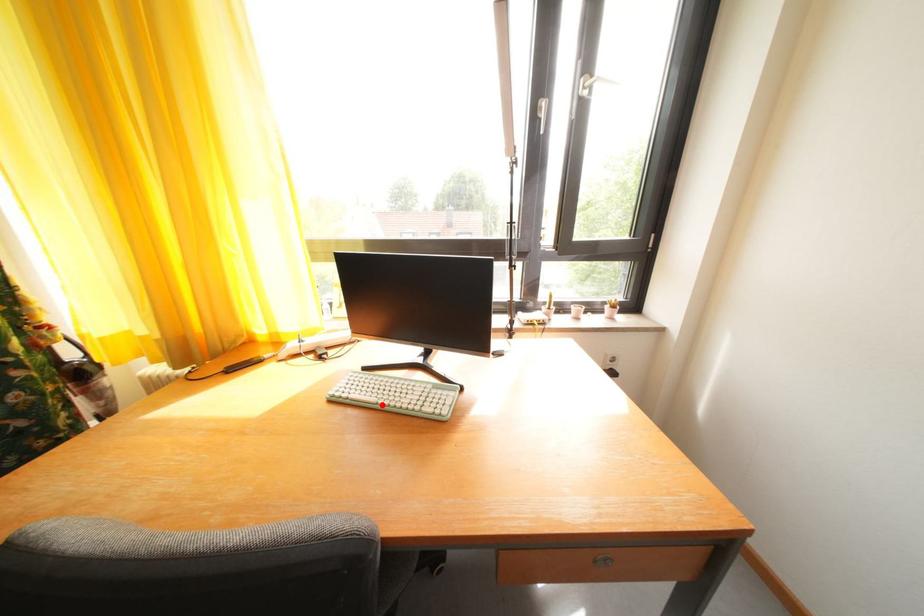
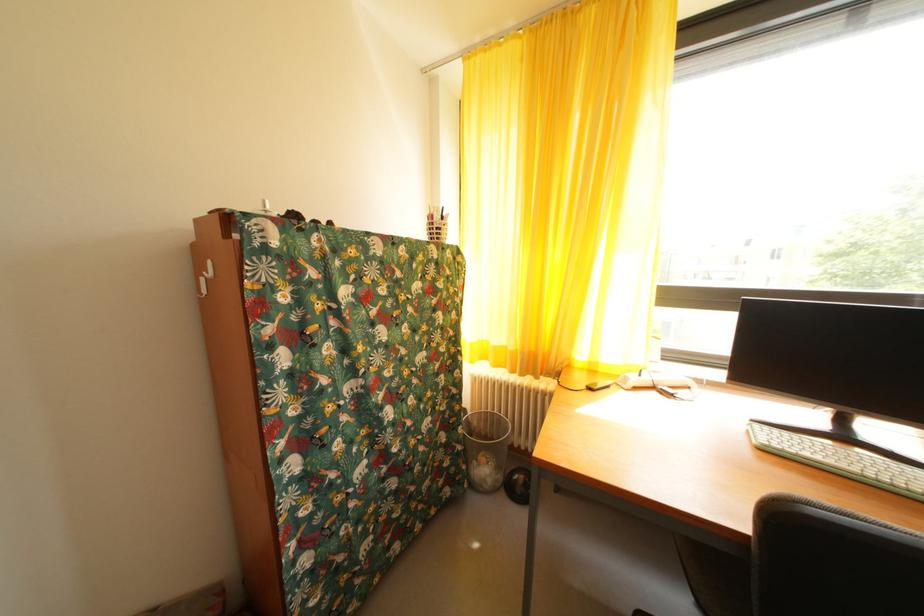
Question: I am providing you with two images of the same scene from different viewpoints. A red point is marked on the first image. Can you still see the location of the red point in image 2?

Choices:
 (A) Yes
 (B) No

Answer: (A)